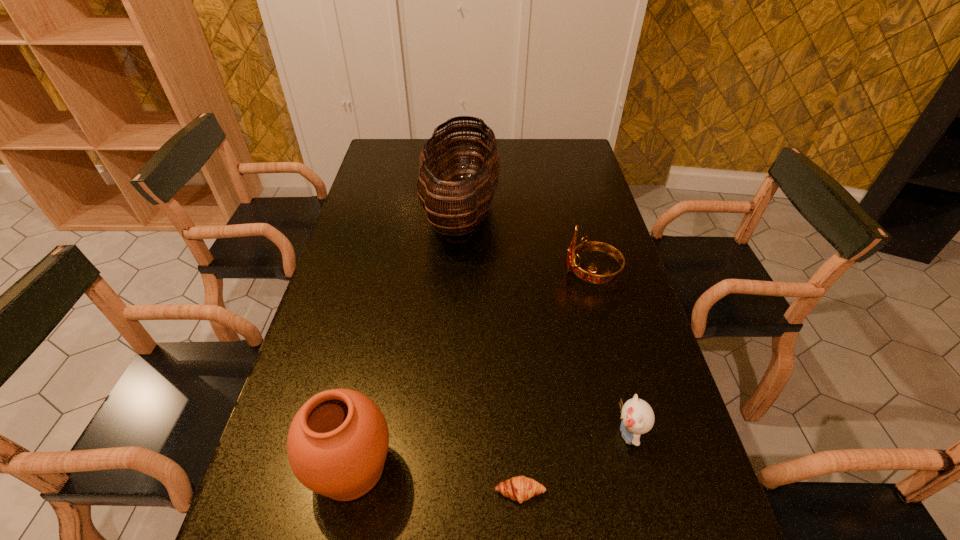
Find the location of a particular element. free point between the pastry and the third shortest object is located at coordinates (556, 383).

Choose which object is the second nearest neighbor to the urn. Please provide its 2D coordinates. Your answer should be formatted as a tuple, i.e. [(x, y)], where the tuple contains the x and y coordinates of a point satisfying the conditions above.

[(637, 416)]

Identify which object is the nearest to the third tallest object. Please provide its 2D coordinates. Your answer should be formatted as a tuple, i.e. [(x, y)], where the tuple contains the x and y coordinates of a point satisfying the conditions above.

[(470, 198)]

Locate an element on the screen. free space that satisfies the following two spatial constraints: 1. on the front-facing side of the second shortest object; 2. on the front-facing side of the pastry is located at coordinates (643, 492).

In order to click on free space in the image that satisfies the following two spatial constraints: 1. on the front-facing side of the third shortest object; 2. on the front-facing side of the pastry in this screenshot , I will do `click(649, 492)`.

This screenshot has width=960, height=540. Find the location of `vacant space that satisfies the following two spatial constraints: 1. on the back side of the basket; 2. on the right side of the urn`. vacant space that satisfies the following two spatial constraints: 1. on the back side of the basket; 2. on the right side of the urn is located at coordinates (405, 210).